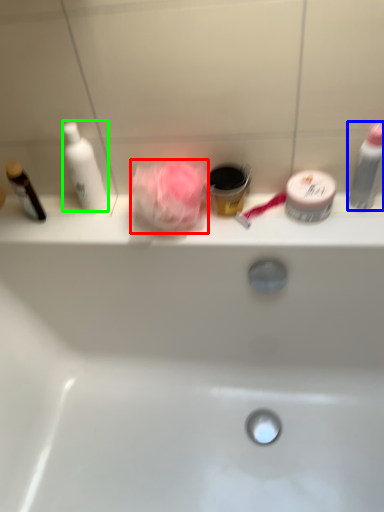
Question: Estimate the real-world distances between objects in this image. Which object is closer to rose (highlighted by a red box), toiletry (highlighted by a blue box) or cleaning product (highlighted by a green box)?

Choices:
 (A) toiletry
 (B) cleaning product

Answer: (B)